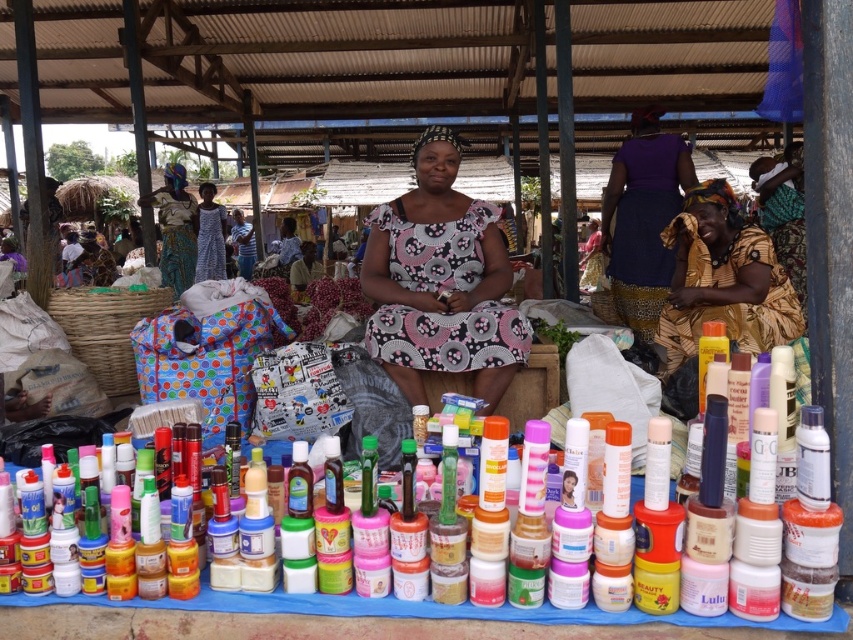
You are standing at the center of the market and want to find the purple fabric skirt at upper right. According to the coordinates provided, in which direction should you look to locate it?

The purple fabric skirt at upper right is located at coordinates point (x=642, y=218), which means it is positioned to the upper right from your current position at the center of the market.

From the picture: You are a vendor at the market and need to place the purple fabric skirt at upper right next to the matte plastic bottles at center. Will the skirt fit horizontally next to the bottles without overlapping?

The purple fabric skirt at upper right is narrower than the matte plastic bottles at center, so it should fit horizontally next to them without overlapping.